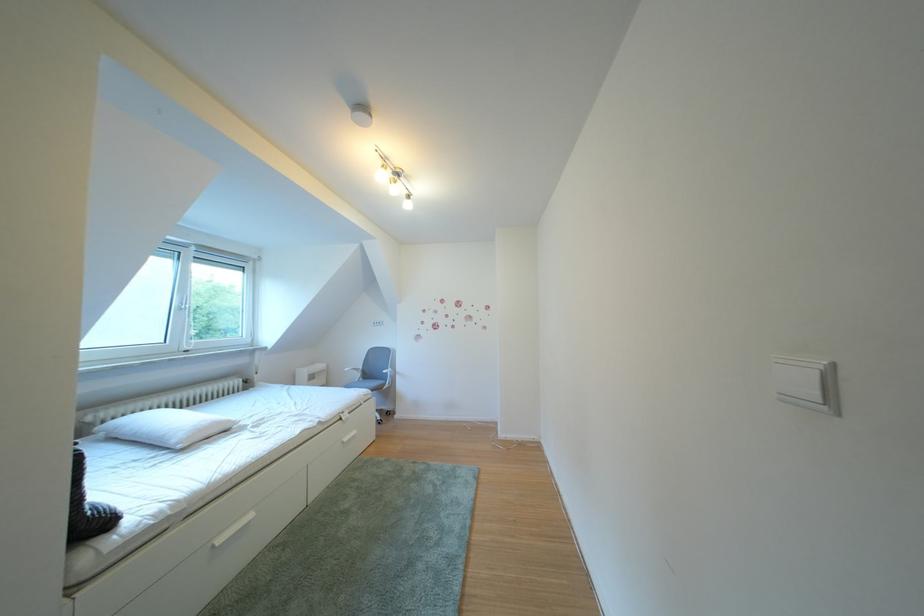
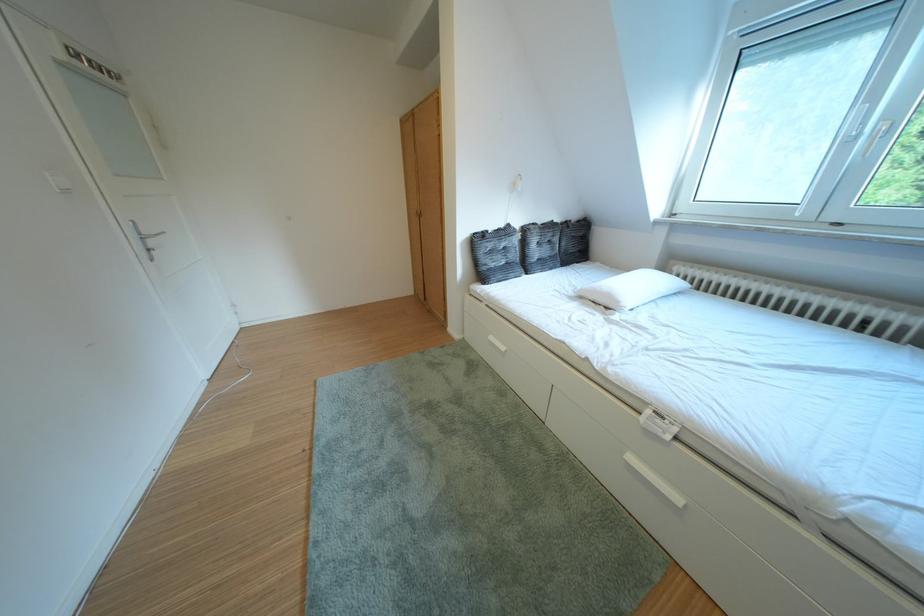
Locate, in the second image, the point that corresponds to [359,445] in the first image.

(646, 464)